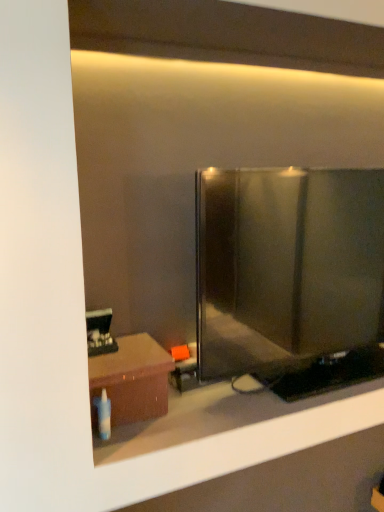
Where is `vacant space underneath matte black glass door at center (from a real-world perspective)`? vacant space underneath matte black glass door at center (from a real-world perspective) is located at coordinates point(292,391).